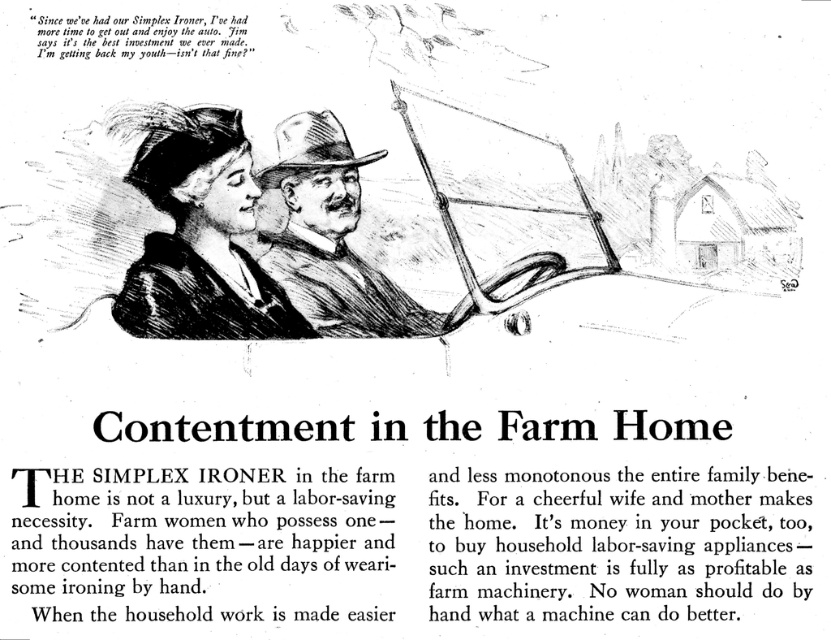
Between point (303, 337) and point (264, 209), which one is positioned in front?

Point (303, 337) is in front.

Between matte black dress at upper left and brown textured hat at center, which one has more height?

With more height is matte black dress at upper left.

Does point (219, 324) come closer to viewer compared to point (325, 257)?

Yes.

What are the coordinates of `matte black dress at upper left` in the screenshot? It's located at (200, 236).